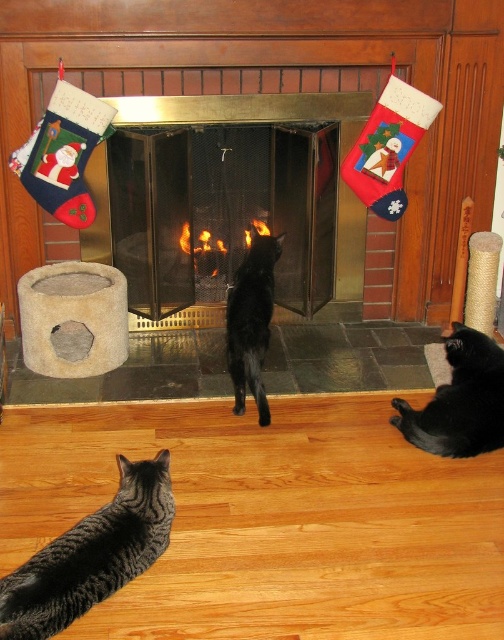
You see a tabby fur cat at lower left and a black glossy cat at center. Which cat is positioned more to the left side of the scene?

The tabby fur cat at lower left is positioned to the left of the black glossy cat at center, so the tabby fur cat at lower left is more to the left.

Looking at this image, you are a guest in this living room and want to sit closer to the heat source. Which object should you move towards, the metallic fireplace at center or the black fur cat at lower right?

The metallic fireplace at center is larger than the black fur cat at lower right, so you should move towards the metallic fireplace at center to get closer to the heat source.

You are a photographer trying to capture a photo of the metallic fireplace at center and the black fur cat at lower right. Since you want to ensure both are in focus, you need to know their sizes relative to each other. Which object is taller?

The metallic fireplace at center is much taller than the black fur cat at lower right, so you can adjust your camera settings accordingly to capture both in focus.